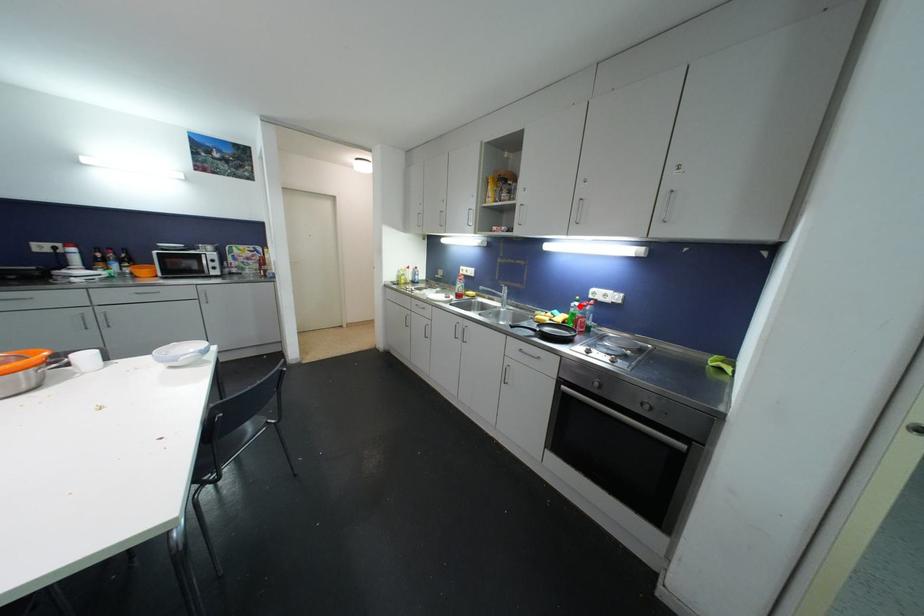
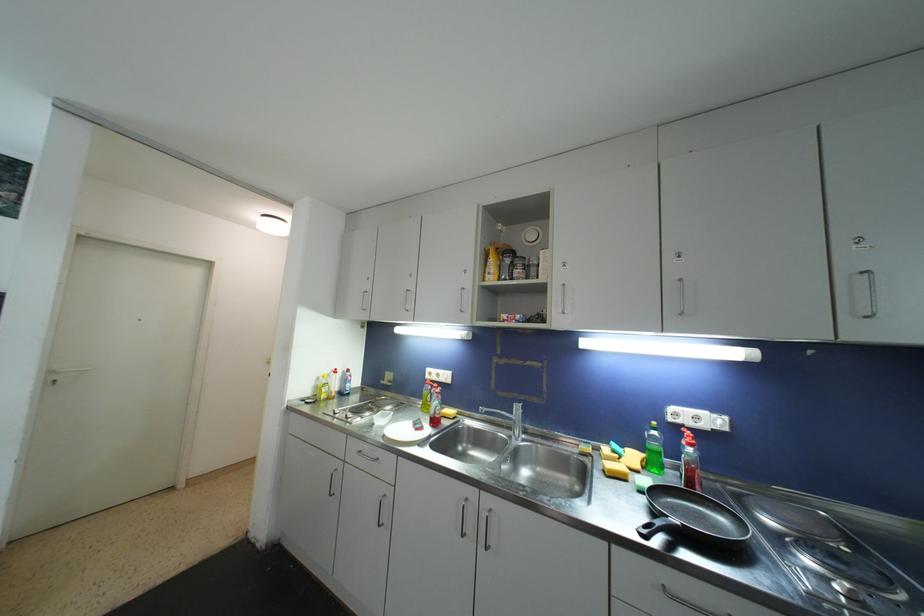
Where in the second image is the point corresponding to the highlighted location from the first image?

(658, 436)